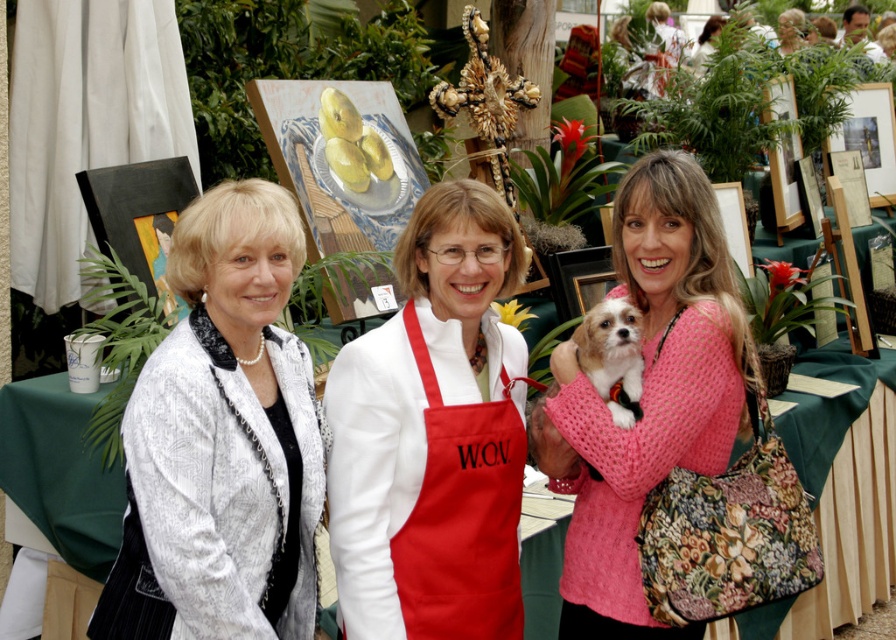
Who is more forward, (x=239, y=561) or (x=725, y=403)?

Positioned in front is point (x=239, y=561).

Between point (307, 561) and point (558, 486), which one is positioned in front?

Point (307, 561)

This screenshot has height=640, width=896. Find the location of `white textured jacket at center`. white textured jacket at center is located at coordinates (222, 440).

Which is behind, point (164, 637) or point (464, 632)?

Positioned behind is point (464, 632).

Is point (265, 243) positioned after point (429, 225)?

No, it is not.

The image size is (896, 640). What are the coordinates of `white textured jacket at center` in the screenshot? It's located at (222, 440).

Does point (286, 460) lie behind point (27, 452)?

No.

Between white textured jacket at center and green fabric table at center, which one is positioned lower?

green fabric table at center

Between point (201, 227) and point (840, 440), which one is positioned in front?

Point (201, 227) is more forward.

Find the location of a particular element. The height and width of the screenshot is (640, 896). white textured jacket at center is located at coordinates (222, 440).